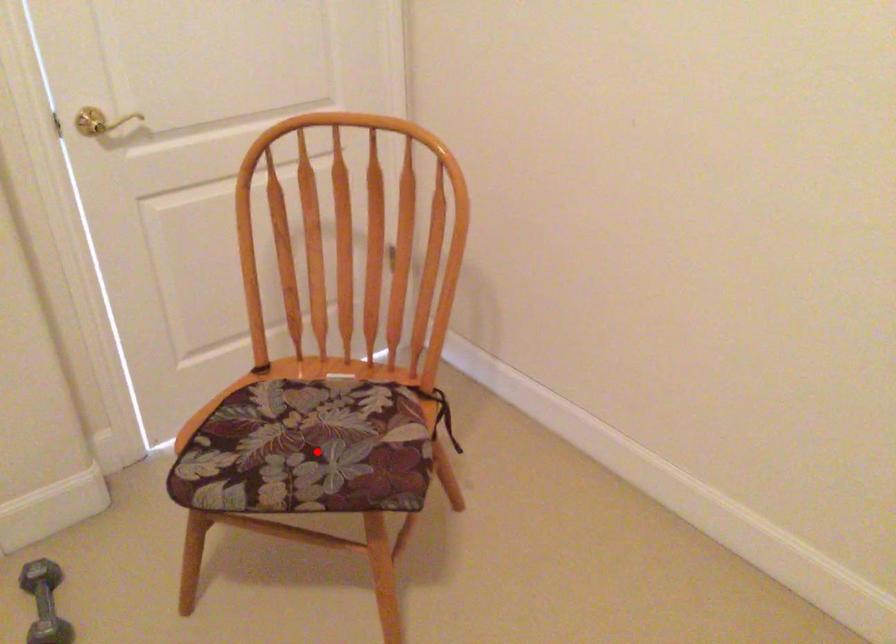
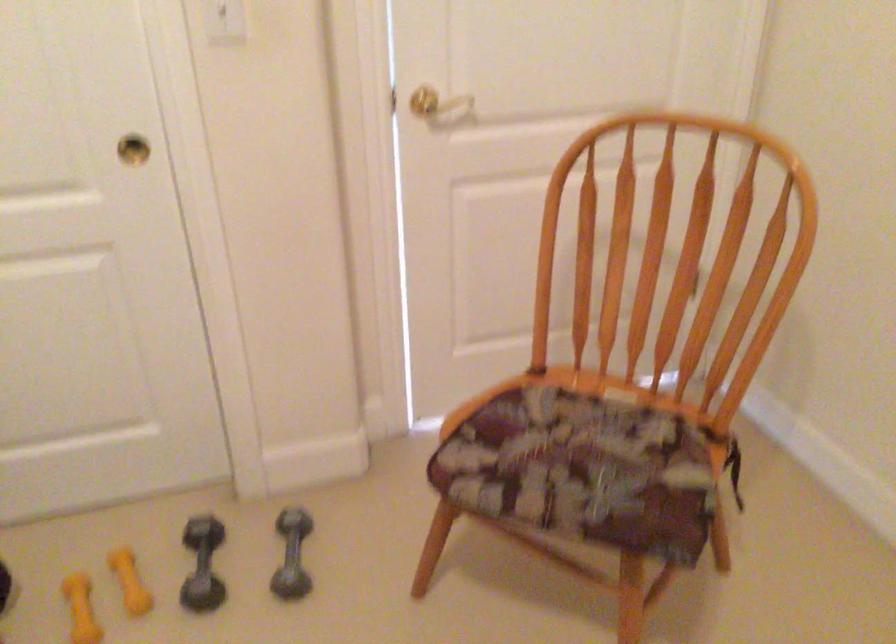
Locate, in the second image, the point that corresponds to the highlighted location in the first image.

(582, 469)